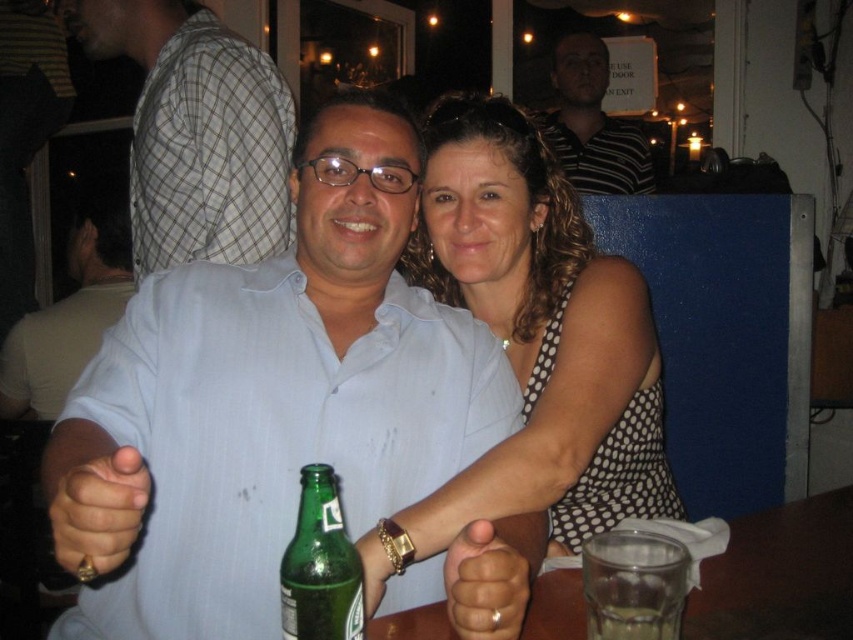
Question: Is matte light blue shirt at center to the right of gold metallic ring at center from the viewer's perspective?

Choices:
 (A) yes
 (B) no

Answer: (B)

Question: Which point is closer to the camera?

Choices:
 (A) matte white shirt at center
 (B) gold ring at center
 (C) transparent glass at lower center

Answer: (B)

Question: Which point is farther to the camera?

Choices:
 (A) (109, 465)
 (B) (287, 557)

Answer: (B)

Question: Is gold metallic ring at center above translucent glass at lower right?

Choices:
 (A) no
 (B) yes

Answer: (B)

Question: Which point appears farthest from the camera in this image?

Choices:
 (A) (509, 563)
 (B) (259, 570)

Answer: (B)

Question: Is green glass bottle at center above gold metallic ring at center?

Choices:
 (A) yes
 (B) no

Answer: (A)